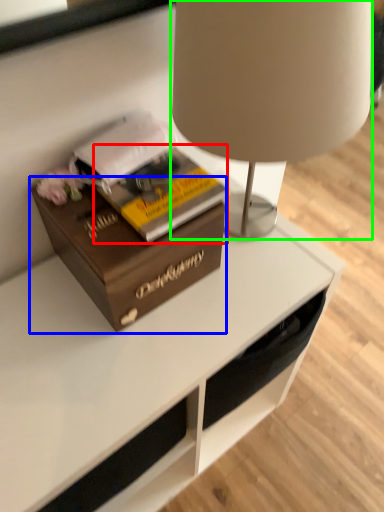
Question: Considering the real-world distances, which object is closest to paperback book (highlighted by a red box)? box (highlighted by a blue box) or lamp (highlighted by a green box).

Choices:
 (A) box
 (B) lamp

Answer: (A)